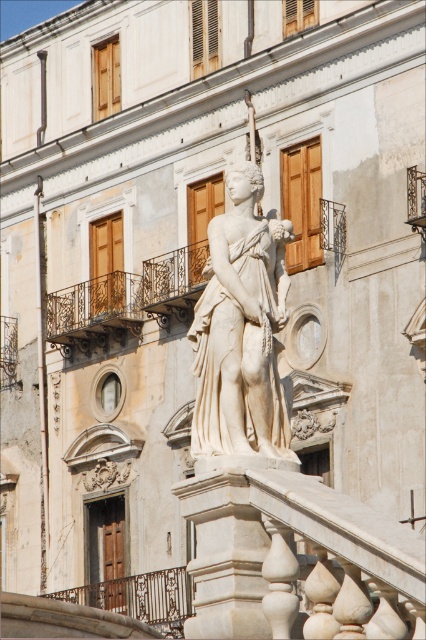
Question: Which object is farther from the camera taking this photo?

Choices:
 (A) white marble statue at center
 (B) white marble pillar at center

Answer: (A)

Question: Does white marble statue at center appear under white marble pillar at center?

Choices:
 (A) no
 (B) yes

Answer: (A)

Question: Which object appears closest to the camera in this image?

Choices:
 (A) dark brown wrought iron balustrade at center
 (B) white marble statue at center

Answer: (B)

Question: Is white marble statue at center further to the viewer compared to dark brown wrought iron balustrade at center?

Choices:
 (A) yes
 (B) no

Answer: (B)

Question: Is white marble pillar at center wider than dark brown wrought iron balustrade at center?

Choices:
 (A) no
 (B) yes

Answer: (A)

Question: Estimate the real-world distances between objects in this image. Which object is closer to the dark brown wrought iron balustrade at center?

Choices:
 (A) white marble statue at center
 (B) white marble pillar at center

Answer: (B)